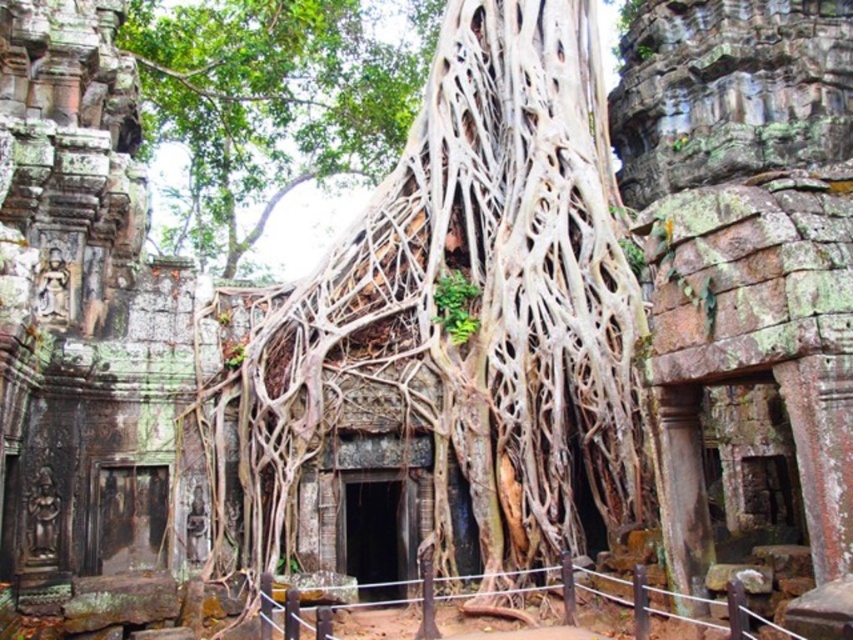
You are an archaeologist examining the ancient temple. You notice the brown textured roots at center and the green leafy tree at center. Which object is positioned to the right of the other?

The brown textured roots at center are to the right of the green leafy tree at center.

You are a photographer standing at the entrance of the temple. You notice two points marked in the scene. Which point, point (x=541, y=253) or point (x=364, y=72), is closer to your camera lens?

Point (x=541, y=253) is closer to the camera lens than point (x=364, y=72).